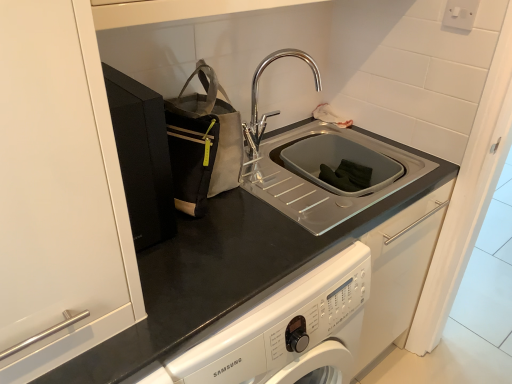
Question: In terms of height, does white plastic electric outlet at upper right look taller or shorter compared to chrome metallic faucet at upper center?

Choices:
 (A) tall
 (B) short

Answer: (B)

Question: Considering their positions, is white plastic electric outlet at upper right located in front of or behind chrome metallic faucet at upper center?

Choices:
 (A) front
 (B) behind

Answer: (B)

Question: Estimate the real-world distances between objects in this image. Which object is closer to the gray fabric tote at upper left?

Choices:
 (A) chrome metallic faucet at upper center
 (B) white plastic electric outlet at upper right

Answer: (A)

Question: Based on their relative distances, which object is nearer to the gray fabric tote at upper left?

Choices:
 (A) white plastic electric outlet at upper right
 (B) chrome metallic faucet at upper center

Answer: (B)